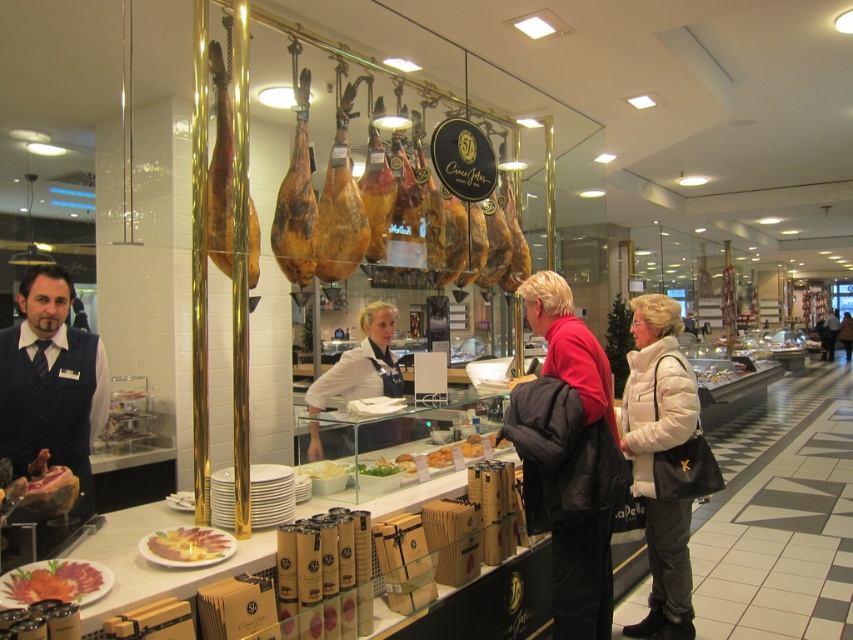
Is point (660, 556) positioned after point (378, 461)?

Yes, point (660, 556) is farther from viewer.

Describe the element at coordinates (660, 451) in the screenshot. I see `white matte jacket at center` at that location.

Between point (663, 442) and point (372, 472), which one is positioned in front?

Point (372, 472) is more forward.

Where is `white matte jacket at center`? white matte jacket at center is located at coordinates (660, 451).

Does gold polished ham at center appear on the right side of white paper plate at center?

In fact, gold polished ham at center is to the left of white paper plate at center.

Where is `gold polished ham at center`? Image resolution: width=853 pixels, height=640 pixels. gold polished ham at center is located at coordinates (219, 170).

Locate an element on the screen. gold polished ham at center is located at coordinates (219, 170).

Where is `gold polished ham at center`? gold polished ham at center is located at coordinates (219, 170).

Is the position of matte black vest at left less distant than that of white paper plate at center?

Yes, it is in front of white paper plate at center.

Who is shorter, matte black vest at left or white paper plate at center?

white paper plate at center is shorter.

Is point (45, 442) positioned in front of point (335, 461)?

Yes, it is in front of point (335, 461).

Identify the location of matte black vest at left. (51, 381).